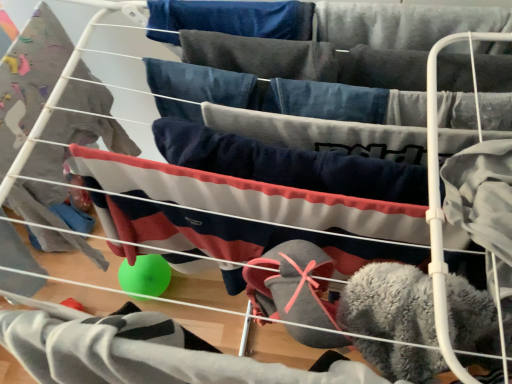
Question: In terms of size, does fuzzy gray socks at lower center, the second clothing in the top-to-bottom sequence, appear bigger or smaller than navy blue fleece pants at center, which is the 2th clothing from bottom to top?

Choices:
 (A) big
 (B) small

Answer: (A)

Question: Is point tap(220, 375) positioned closer to the camera than point tap(400, 172)?

Choices:
 (A) farther
 (B) closer

Answer: (B)

Question: In the image, is fuzzy gray socks at lower center, acting as the first clothing starting from the bottom, on the left side or the right side of navy blue fleece pants at center, which is counted as the first clothing, starting from the top?

Choices:
 (A) right
 (B) left

Answer: (B)

Question: From the image's perspective, is navy blue fleece pants at center, which is the 2th clothing from bottom to top, located above or below fuzzy gray socks at lower center, the second clothing in the top-to-bottom sequence?

Choices:
 (A) below
 (B) above

Answer: (B)

Question: In the image, is navy blue fleece pants at center, which is the 2th clothing from bottom to top, on the left side or the right side of fuzzy gray socks at lower center, the second clothing in the top-to-bottom sequence?

Choices:
 (A) right
 (B) left

Answer: (A)

Question: Relative to fuzzy gray socks at lower center, acting as the first clothing starting from the bottom, is navy blue fleece pants at center, which is the 2th clothing from bottom to top, in front or behind?

Choices:
 (A) front
 (B) behind

Answer: (B)

Question: Based on their sizes in the image, would you say navy blue fleece pants at center, which is counted as the first clothing, starting from the top, is bigger or smaller than fuzzy gray socks at lower center, the second clothing in the top-to-bottom sequence?

Choices:
 (A) small
 (B) big

Answer: (A)